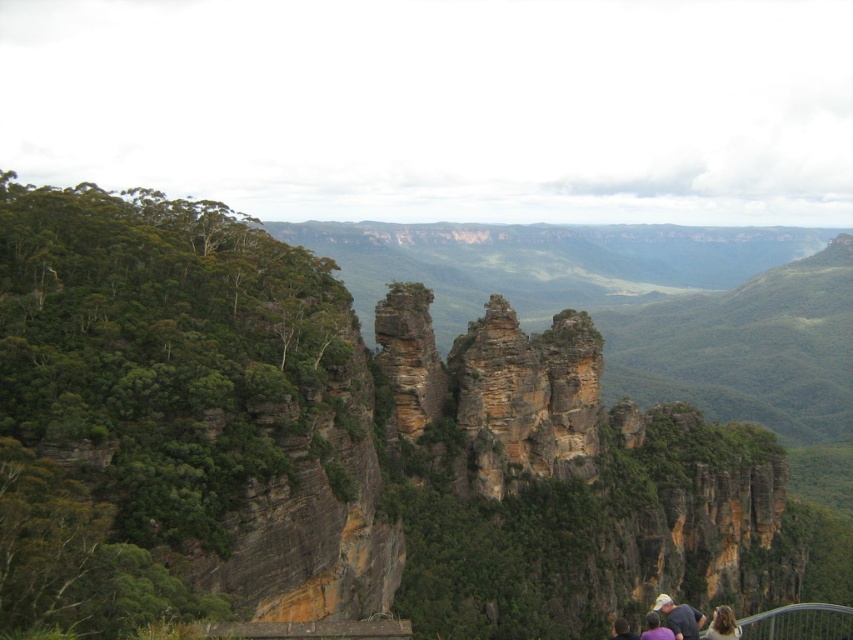
Question: Is tan leather hat at lower center wider than purple fabric at lower right?

Choices:
 (A) yes
 (B) no

Answer: (A)

Question: Can you confirm if tan leather hat at lower center is wider than dark brown hair at lower right?

Choices:
 (A) no
 (B) yes

Answer: (B)

Question: Which is farther from the tan leather hat at lower center?

Choices:
 (A) rugged rock formation at center
 (B) rugged stone rock formation at center

Answer: (B)

Question: Where is rugged rock formation at center located in relation to metal/rusty rail at lower right in the image?

Choices:
 (A) right
 (B) left

Answer: (B)

Question: Which of the following is the farthest from the observer?

Choices:
 (A) tan leather hat at lower center
 (B) rugged stone rock formation at center
 (C) rugged rock formation at center

Answer: (B)

Question: Which of these objects is positioned farthest from the purple fabric at lower right?

Choices:
 (A) rugged rock formation at center
 (B) metal/rusty rail at lower right
 (C) tan leather hat at lower center

Answer: (A)